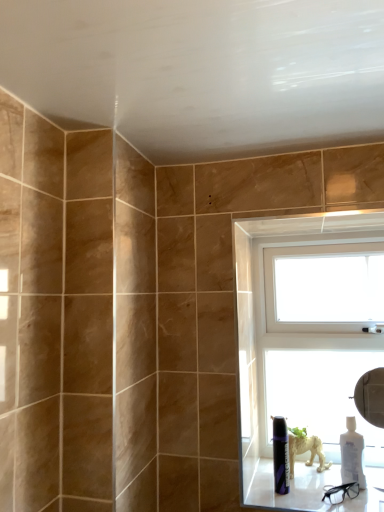
Question: In terms of size, does white glossy window sill at lower right appear bigger or smaller than white plastic window at upper right?

Choices:
 (A) big
 (B) small

Answer: (B)

Question: From a real-world perspective, is white glossy window sill at lower right positioned above or below white plastic window at upper right?

Choices:
 (A) above
 (B) below

Answer: (B)

Question: Estimate the real-world distances between objects in this image. Which object is farther from the white glossy bottle at lower right?

Choices:
 (A) white glossy window sill at lower right
 (B) white plastic window at upper right
 (C) matte black can at lower right

Answer: (B)

Question: Which is nearer to the white glossy bottle at lower right?

Choices:
 (A) matte black can at lower right
 (B) white plastic window at upper right
 (C) white glossy window sill at lower right

Answer: (C)